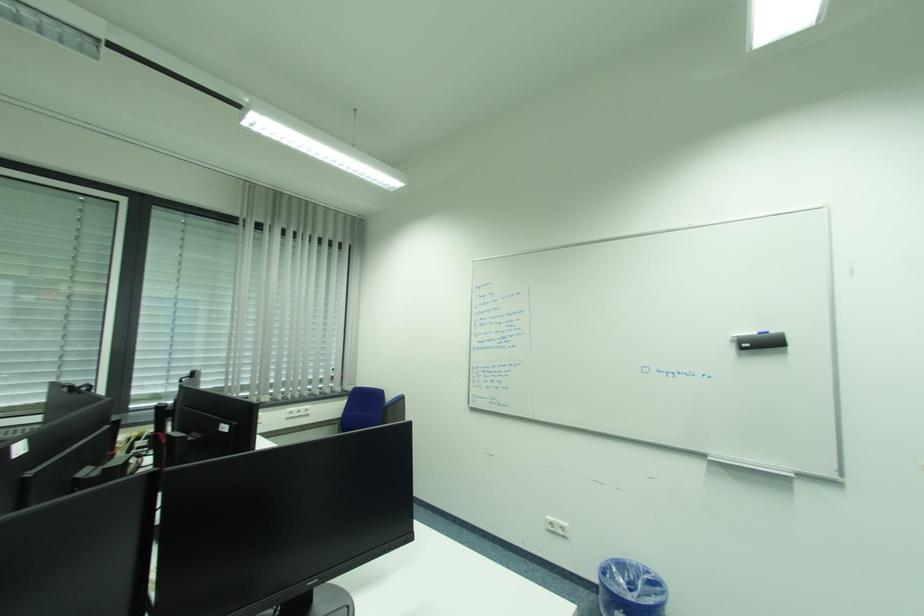
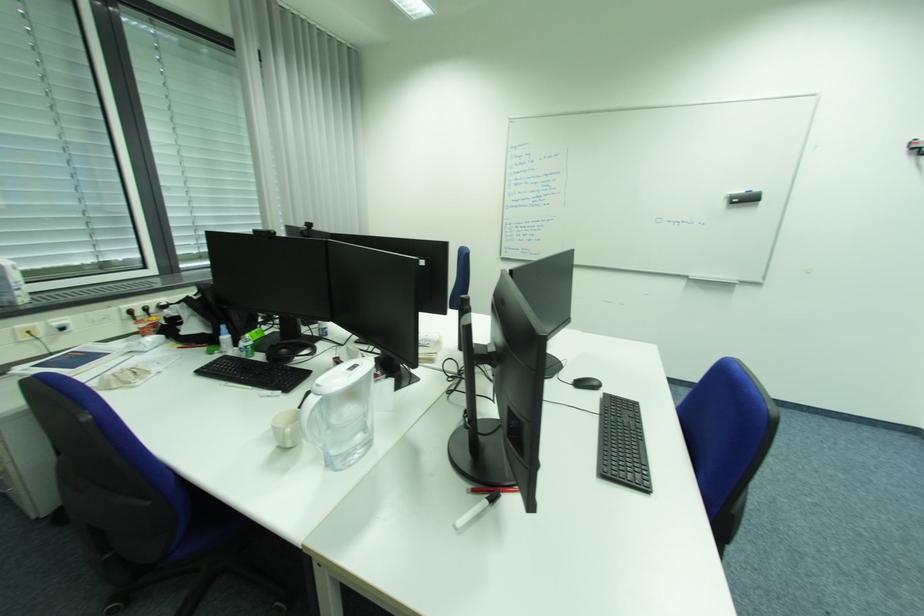
Question: In a continuous first-person perspective shot, in which direction is the camera moving?

Choices:
 (A) Left
 (B) Right
 (C) Forward
 (D) Backward

Answer: (A)